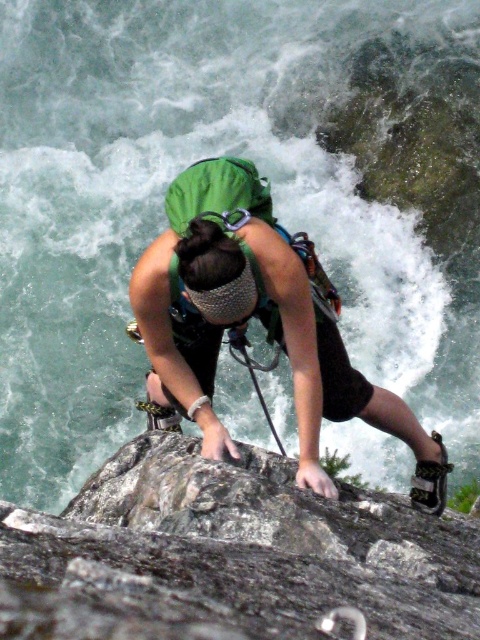
Question: Does gray rough rock at center have a smaller size compared to green fabric helmet at center?

Choices:
 (A) no
 (B) yes

Answer: (B)

Question: Which object is closer to the camera taking this photo?

Choices:
 (A) gray rough rock at center
 (B) green fabric helmet at center

Answer: (A)

Question: Does gray rough rock at center have a lesser width compared to green fabric helmet at center?

Choices:
 (A) no
 (B) yes

Answer: (A)

Question: Which point is farther from the camera taking this photo?

Choices:
 (A) (348, 636)
 (B) (160, 358)

Answer: (B)

Question: Can you confirm if gray rough rock at center is smaller than green fabric helmet at center?

Choices:
 (A) no
 (B) yes

Answer: (B)